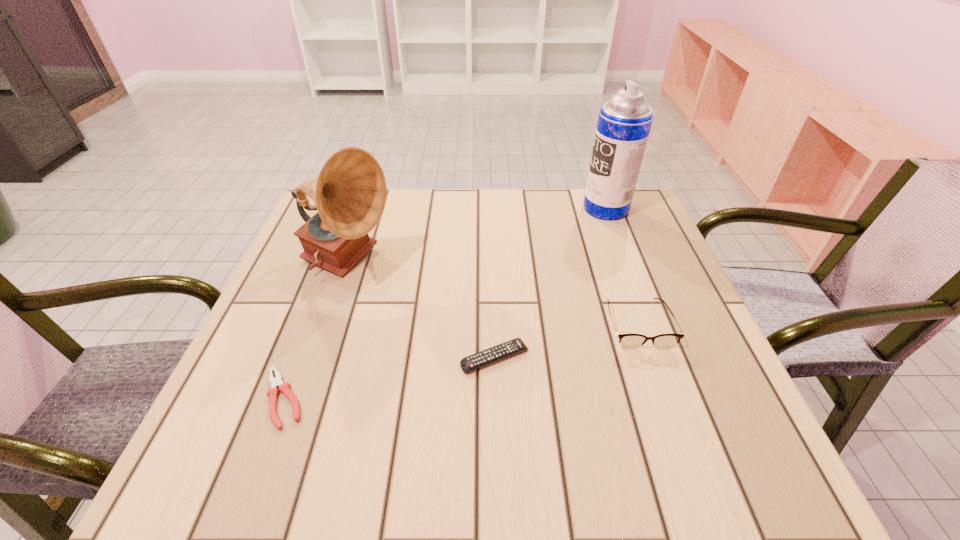
This screenshot has width=960, height=540. In order to click on aerosol can in this screenshot , I will do `click(624, 122)`.

What are the coordinates of `phonograph record` in the screenshot? It's located at (349, 193).

The image size is (960, 540). Identify the location of the third shortest object. coord(627,341).

Locate an element on the screen. the third object from left to right is located at coordinates (491, 355).

Image resolution: width=960 pixels, height=540 pixels. Find the location of `pliers`. pliers is located at coordinates (284, 387).

Locate an element on the screen. The image size is (960, 540). vacant space located on the label side of the farthest object is located at coordinates (528, 208).

I want to click on blank space located on the label side of the farthest object, so click(x=495, y=208).

Identify the location of vacant space located on the label side of the farthest object. The image size is (960, 540). (546, 208).

What are the coordinates of `vacant space positioned 0.360m on the horn of the phonograph record` in the screenshot? It's located at (550, 265).

This screenshot has height=540, width=960. Identify the location of vacant space located 0.060m on the face of the spectacles. (656, 376).